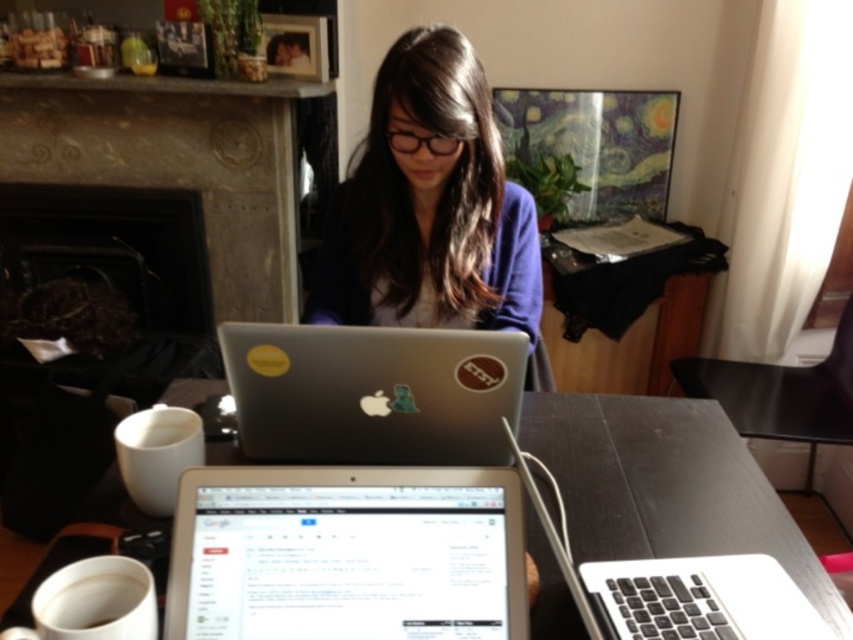
Is point (210, 529) behind point (502, 154)?

No, (210, 529) is in front of (502, 154).

Between silver metallic tablet at center and matte purple sweater at center, which one is positioned lower?

silver metallic tablet at center

Locate an element on the screen. Image resolution: width=853 pixels, height=640 pixels. silver metallic tablet at center is located at coordinates (346, 554).

Image resolution: width=853 pixels, height=640 pixels. I want to click on silver metallic laptop at center, so (373, 392).

Does silver metallic laptop at center have a lesser height compared to white matte cup at lower left?

In fact, silver metallic laptop at center may be taller than white matte cup at lower left.

Where is `silver metallic laptop at center`? silver metallic laptop at center is located at coordinates (373, 392).

Which is more to the left, matte purple sweater at center or black matte table at center?

Positioned to the left is matte purple sweater at center.

Is matte purple sweater at center to the left of black matte table at center from the viewer's perspective?

Indeed, matte purple sweater at center is positioned on the left side of black matte table at center.

At what (x,y) coordinates should I click in order to perform the action: click on matte purple sweater at center. Please return your answer as a coordinate pair (x, y). This screenshot has height=640, width=853. Looking at the image, I should click on (432, 209).